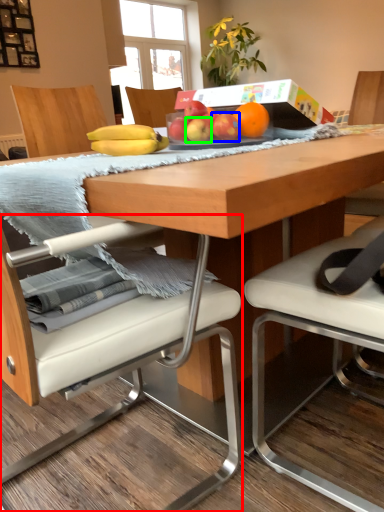
Question: Which object is the closest to the chair (highlighted by a red box)? Choose among these: apple (highlighted by a blue box) or apple (highlighted by a green box).

Choices:
 (A) apple
 (B) apple

Answer: (B)